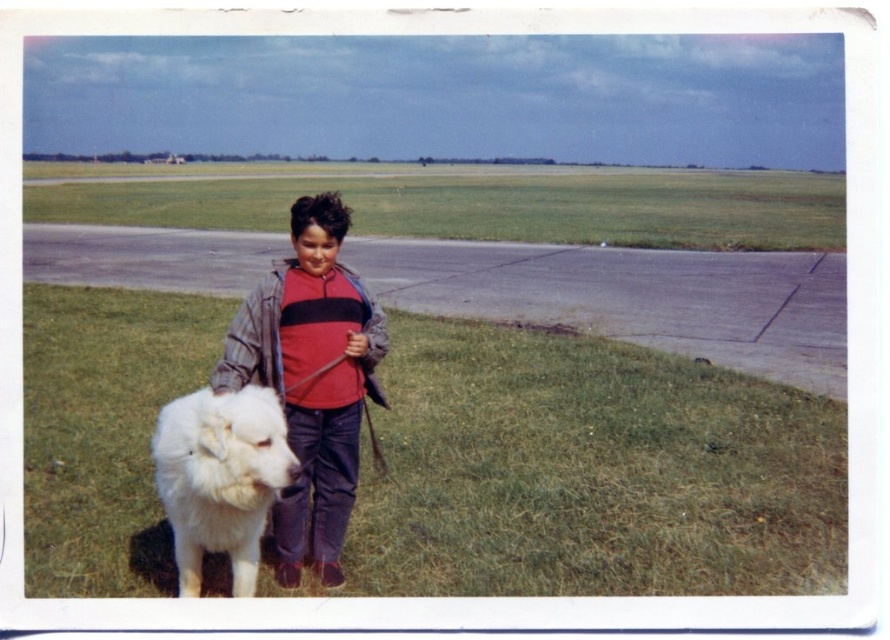
Question: Is gray asphalt runway at center behind matte red shirt at center?

Choices:
 (A) no
 (B) yes

Answer: (B)

Question: Which point appears closest to the camera in this image?

Choices:
 (A) (270, 358)
 (B) (126, 246)
 (C) (727, 497)

Answer: (A)

Question: Which of the following is the farthest from the observer?

Choices:
 (A) (261, 225)
 (B) (229, 506)
 (C) (83, 301)
 (D) (333, 454)

Answer: (A)

Question: Can you confirm if green grass at lower left is wider than white fluffy dog at lower left?

Choices:
 (A) yes
 (B) no

Answer: (A)

Question: Does green grass at lower left come behind green grass at upper center?

Choices:
 (A) no
 (B) yes

Answer: (A)

Question: Based on their relative distances, which object is farther from the matte red shirt at center?

Choices:
 (A) white fluffy dog at lower left
 (B) green grass at lower left
 (C) green grass at upper center

Answer: (C)